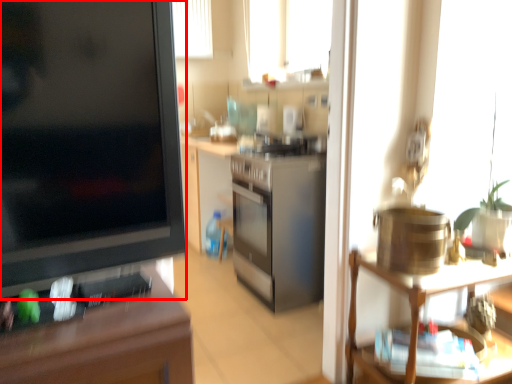
Question: From the image's perspective, where is desk (annotated by the red box) located relative to shelf?

Choices:
 (A) below
 (B) above

Answer: (B)